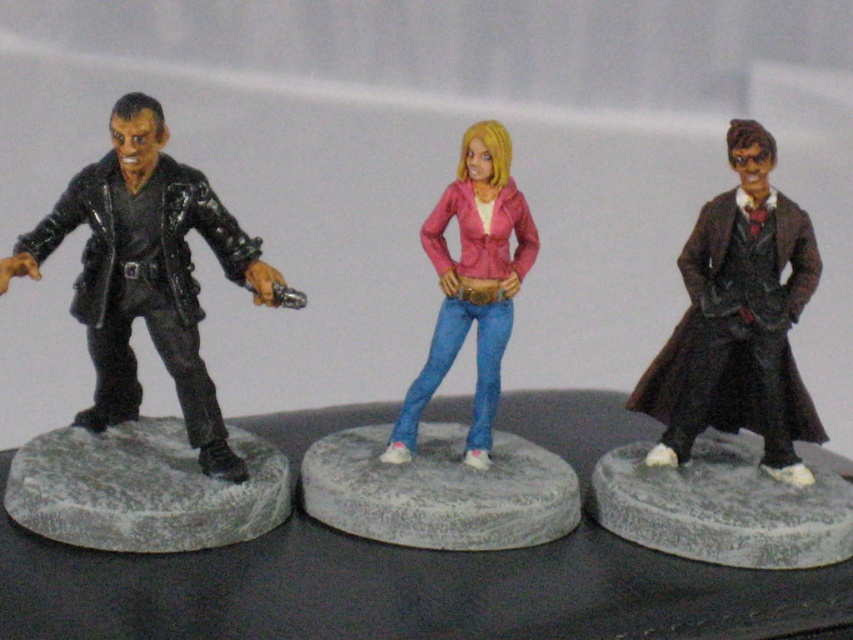
Question: Which point is farther to the camera?

Choices:
 (A) (283, 291)
 (B) (775, 556)
 (C) (727, 131)
 (D) (473, 228)

Answer: (C)

Question: Does gray concrete base at left come behind pink matte jacket at center?

Choices:
 (A) yes
 (B) no

Answer: (B)

Question: Estimate the real-world distances between objects in this image. Which object is farther from the shiny brown coat at right?

Choices:
 (A) shiny black figure at left
 (B) gray concrete base at left
 (C) pink matte jacket at center

Answer: (B)

Question: Does gray concrete base at center appear on the left side of pink matte jacket at center?

Choices:
 (A) yes
 (B) no

Answer: (B)

Question: Does gray stone at center have a lesser width compared to pink matte jacket at center?

Choices:
 (A) yes
 (B) no

Answer: (B)

Question: Considering the real-world distances, which object is farthest from the pink matte jacket at center?

Choices:
 (A) shiny brown coat at right
 (B) gray concrete base at center
 (C) shiny black figure at left
 (D) gray concrete base at left

Answer: (D)